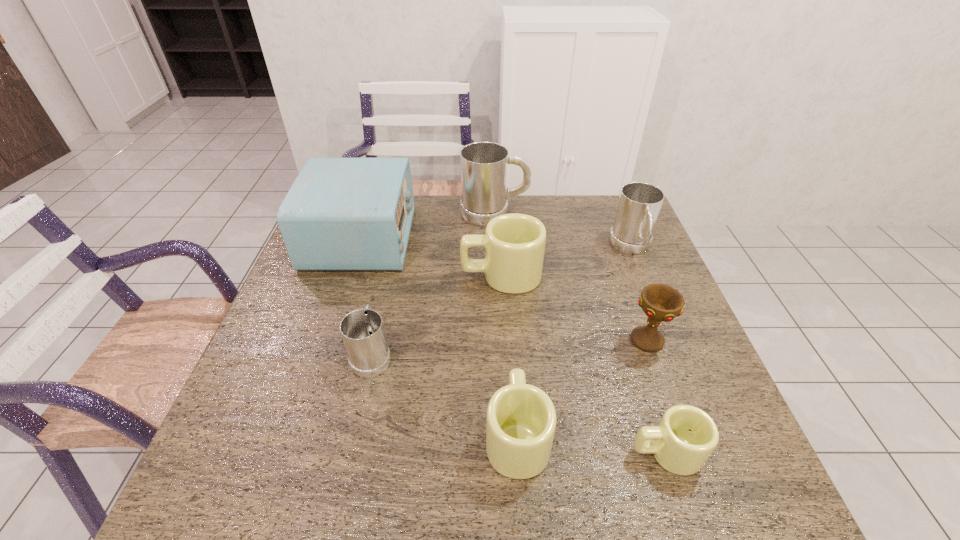
This screenshot has width=960, height=540. Identify the location of object that ranks as the fourth closest to the biggest gray mug. (661, 303).

Image resolution: width=960 pixels, height=540 pixels. In order to click on the fourth closest mug to the leftmost gray mug in this screenshot , I will do `click(686, 436)`.

Select which mug appears as the second closest to the second biggest beige mug. Please provide its 2D coordinates. Your answer should be formatted as a tuple, i.e. [(x, y)], where the tuple contains the x and y coordinates of a point satisfying the conditions above.

[(362, 330)]

Identify which gray mug is the third closest to the red chalice. Please provide its 2D coordinates. Your answer should be formatted as a tuple, i.e. [(x, y)], where the tuple contains the x and y coordinates of a point satisfying the conditions above.

[(362, 330)]

Locate an element on the screen. Image resolution: width=960 pixels, height=540 pixels. the closest gray mug relative to the shortest mug is located at coordinates (639, 205).

Where is `beige mug that is the second closest to the smallest beige mug`? beige mug that is the second closest to the smallest beige mug is located at coordinates (514, 244).

Find the location of a particular element. beige mug that is the second closest one to the second biggest beige mug is located at coordinates (514, 244).

Identify the location of vacant position in the image that satisfies the following two spatial constraints: 1. with the handle on the side of the farthest beige mug; 2. on the left side of the chalice. (505, 341).

The height and width of the screenshot is (540, 960). Find the location of `free space that satisfies the following two spatial constraints: 1. with the handle on the side of the second smallest beige mug; 2. with the handle on the side of the biggest beige mug`. free space that satisfies the following two spatial constraints: 1. with the handle on the side of the second smallest beige mug; 2. with the handle on the side of the biggest beige mug is located at coordinates (506, 275).

Locate an element on the screen. vacant area that satisfies the following two spatial constraints: 1. on the side of the chalice with the handle; 2. on the right side of the farthest mug is located at coordinates (500, 341).